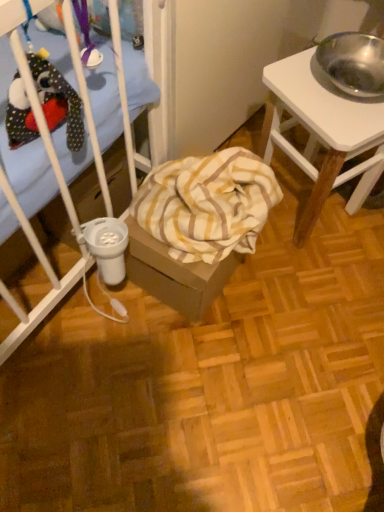
This screenshot has width=384, height=512. I want to click on blank space situated above white wood desk at right (from a real-world perspective), so click(x=340, y=85).